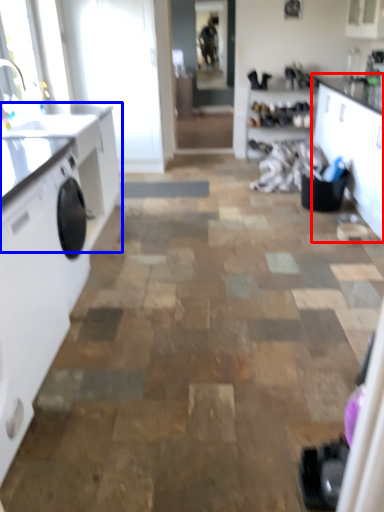
Question: Which object is closer to the camera taking this photo, cabinetry (highlighted by a red box) or countertop (highlighted by a blue box)?

Choices:
 (A) cabinetry
 (B) countertop

Answer: (A)